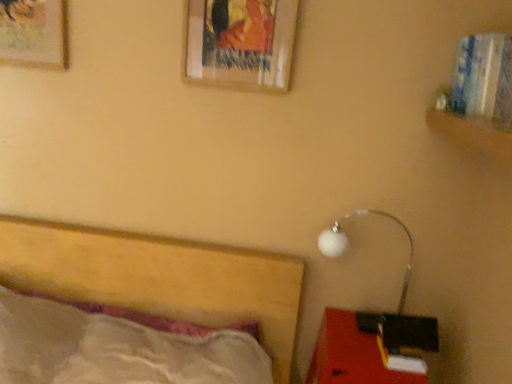
Question: From a real-world perspective, is wooden picture frame at upper left, the second picture frame viewed from the right, on wooden picture frame at upper center, which is the 1th picture frame from right to left?

Choices:
 (A) yes
 (B) no

Answer: (B)

Question: Considering the relative sizes of wooden picture frame at upper left, the second picture frame viewed from the right, and wooden picture frame at upper center, positioned as the second picture frame in left-to-right order, in the image provided, is wooden picture frame at upper left, the second picture frame viewed from the right, thinner than wooden picture frame at upper center, positioned as the second picture frame in left-to-right order,?

Choices:
 (A) no
 (B) yes

Answer: (B)

Question: From the image's perspective, is wooden picture frame at upper left, the second picture frame viewed from the right, below wooden picture frame at upper center, positioned as the second picture frame in left-to-right order?

Choices:
 (A) no
 (B) yes

Answer: (A)

Question: Considering the relative sizes of wooden picture frame at upper left, the second picture frame viewed from the right, and wooden picture frame at upper center, which is the 1th picture frame from right to left, in the image provided, is wooden picture frame at upper left, the second picture frame viewed from the right, bigger than wooden picture frame at upper center, which is the 1th picture frame from right to left,?

Choices:
 (A) yes
 (B) no

Answer: (B)

Question: From the image's perspective, is wooden picture frame at upper left, the second picture frame viewed from the right, on top of wooden picture frame at upper center, which is the 1th picture frame from right to left?

Choices:
 (A) yes
 (B) no

Answer: (A)

Question: From a real-world perspective, is wooden picture frame at upper left, the first picture frame viewed from the left, located beneath wooden picture frame at upper center, which is the 1th picture frame from right to left?

Choices:
 (A) yes
 (B) no

Answer: (A)

Question: Does white glossy lamp at lower right have a smaller size compared to wooden picture frame at upper left, the first picture frame viewed from the left?

Choices:
 (A) yes
 (B) no

Answer: (B)

Question: From a real-world perspective, is white glossy lamp at lower right on wooden picture frame at upper left, the second picture frame viewed from the right?

Choices:
 (A) no
 (B) yes

Answer: (A)

Question: Does white glossy lamp at lower right appear on the right side of wooden picture frame at upper left, the first picture frame viewed from the left?

Choices:
 (A) yes
 (B) no

Answer: (A)

Question: Is white glossy lamp at lower right to the left of wooden picture frame at upper left, the first picture frame viewed from the left, from the viewer's perspective?

Choices:
 (A) no
 (B) yes

Answer: (A)

Question: Are white glossy lamp at lower right and wooden picture frame at upper left, the first picture frame viewed from the left, far apart?

Choices:
 (A) yes
 (B) no

Answer: (A)

Question: From the image's perspective, is white glossy lamp at lower right on top of wooden picture frame at upper left, the first picture frame viewed from the left?

Choices:
 (A) yes
 (B) no

Answer: (B)

Question: Is wooden picture frame at upper center, which is the 1th picture frame from right to left, not near matte red desk at lower right?

Choices:
 (A) yes
 (B) no

Answer: (A)